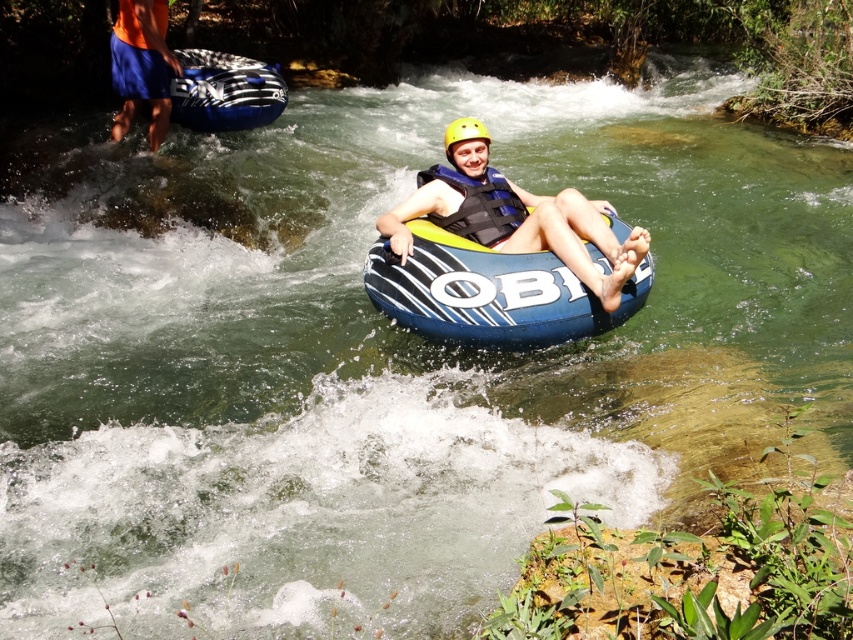
Is point (521, 326) positioned in front of point (149, 52)?

Yes, point (521, 326) is closer to viewer.

Is point (527, 282) farther from camera compared to point (111, 36)?

That is False.

I want to click on blue striped raft at center, so click(x=490, y=291).

Which is more to the right, blue striped raft at upper left or orange fabric shorts at upper left?

blue striped raft at upper left is more to the right.

Between blue striped raft at upper left and orange fabric shorts at upper left, which one has more height?

With more height is orange fabric shorts at upper left.

Who is more distant from viewer, (178, 112) or (154, 104)?

The point (178, 112) is more distant.

Locate an element on the screen. This screenshot has height=640, width=853. blue striped raft at upper left is located at coordinates (225, 92).

Is point (256, 116) positioned in front of point (438, 218)?

No, it is not.

You are a GUI agent. You are given a task and a screenshot of the screen. Output one action in this format:
    pyautogui.click(x=<x>, y=<y>)
    Task: Click on the blue striped raft at upper left
    
    Given the screenshot: What is the action you would take?
    pyautogui.click(x=225, y=92)